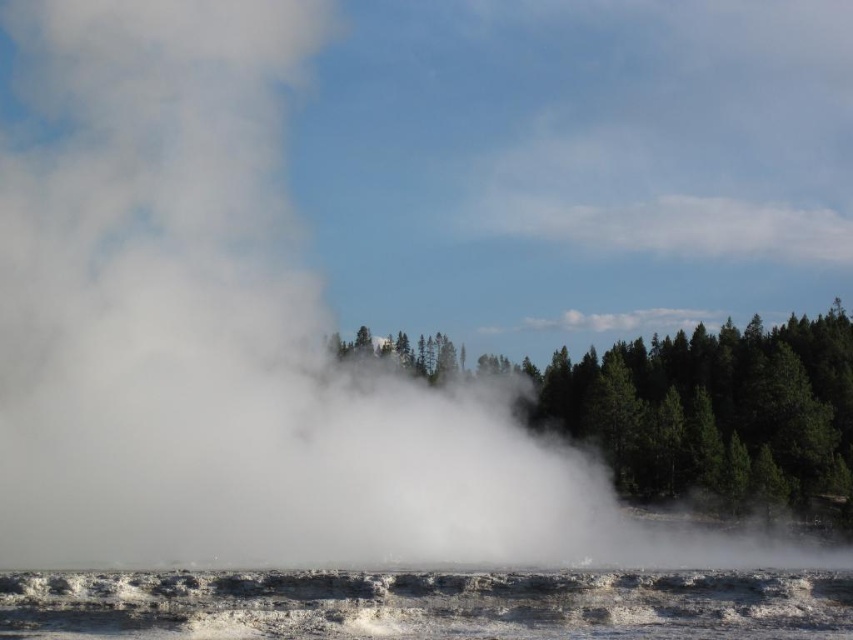
Is white frothy water at lower center below green matte trees at center?

Yes, white frothy water at lower center is below green matte trees at center.

Locate an element on the screen. white frothy water at lower center is located at coordinates (426, 604).

You are a GUI agent. You are given a task and a screenshot of the screen. Output one action in this format:
    pyautogui.click(x=<x>, y=<y>)
    Task: Click on the white frothy water at lower center
    
    Given the screenshot: What is the action you would take?
    pyautogui.click(x=426, y=604)